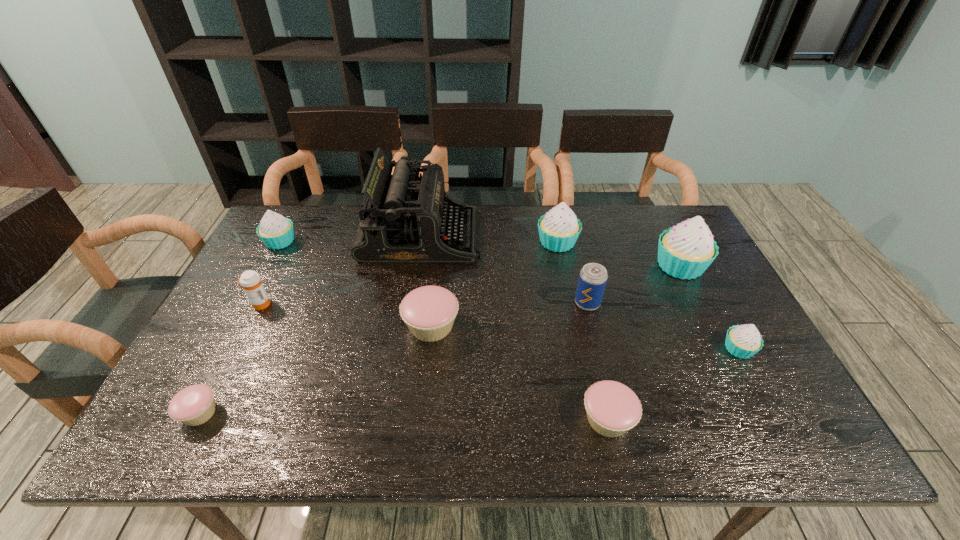
The image size is (960, 540). I want to click on unoccupied area between the rightmost pink cupcake and the medicine, so click(434, 361).

Locate an element on the screen. vacant space in between the second white cupcake from left to right and the nearest white cupcake is located at coordinates (648, 295).

At what (x,y) coordinates should I click in order to perform the action: click on free space between the beer can and the second smallest pink cupcake. Please return your answer as a coordinate pair (x, y). Image resolution: width=960 pixels, height=540 pixels. Looking at the image, I should click on point(597,361).

This screenshot has width=960, height=540. Identify the location of the fourth closest object to the nearest white cupcake. (559, 229).

Identify which object is the fifth nearest to the second biggest white cupcake. Please provide its 2D coordinates. Your answer should be formatted as a tuple, i.e. [(x, y)], where the tuple contains the x and y coordinates of a point satisfying the conditions above.

[(743, 341)]

Find the location of a particular element. This screenshot has width=960, height=540. cupcake that is the second closest to the second smallest pink cupcake is located at coordinates (429, 312).

Where is `cupcake that is the sixth closest one to the beer can`? This screenshot has height=540, width=960. cupcake that is the sixth closest one to the beer can is located at coordinates (276, 232).

I want to click on white cupcake object that ranks as the closest to the nearest white cupcake, so click(685, 251).

Where is `white cupcake identified as the third closest to the typewriter`? white cupcake identified as the third closest to the typewriter is located at coordinates (685, 251).

This screenshot has height=540, width=960. I want to click on pink cupcake that is the closest to the beer can, so click(612, 408).